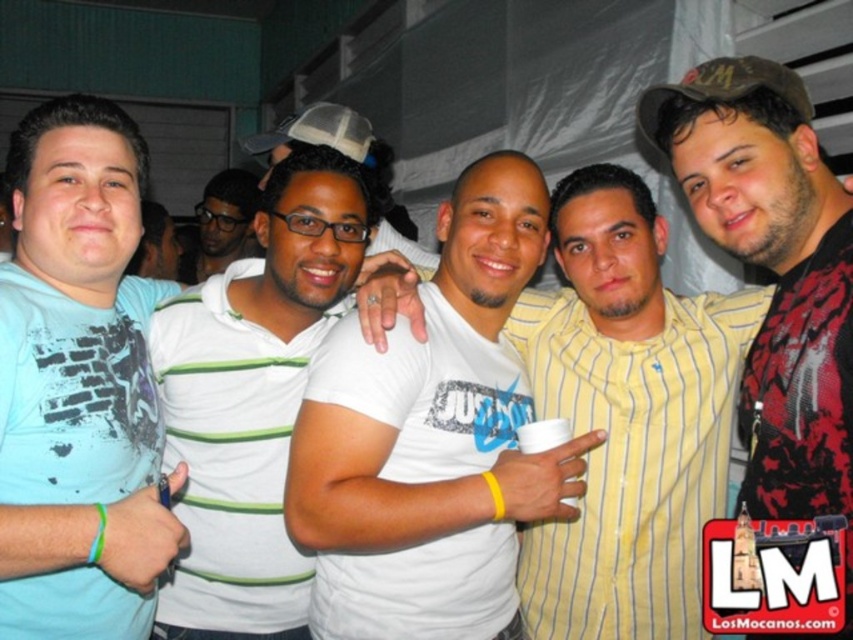
You are standing at the event and want to hand a gift to the man wearing the dark red textured shirt at center. The gift requires you to be within 3 feet to hand it properly. Can you reach him without moving closer?

The distance between you and the dark red textured shirt at center is 38.49 inches, which is exactly 3.208 feet. Since the required distance is within 3 feet, you are slightly too far to hand the gift properly without moving closer.